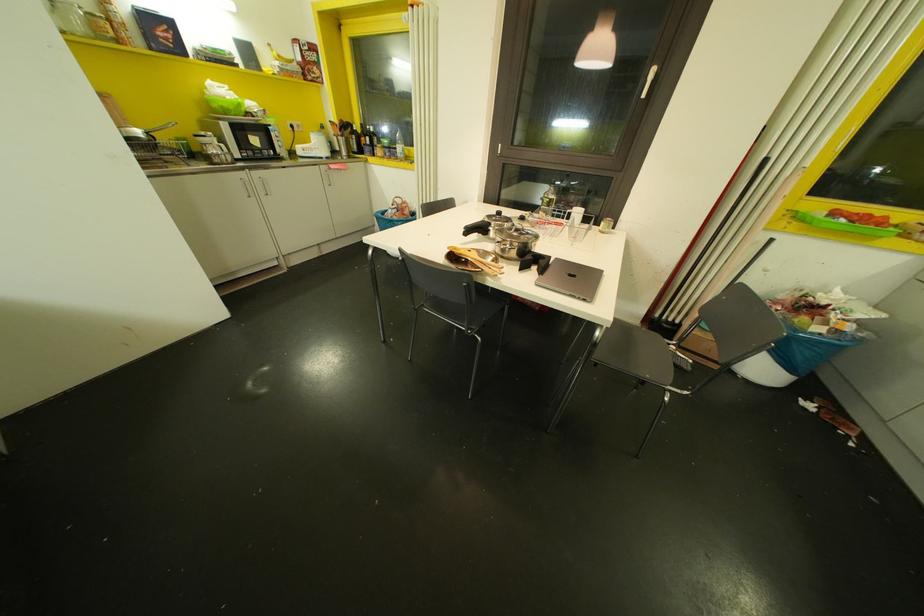
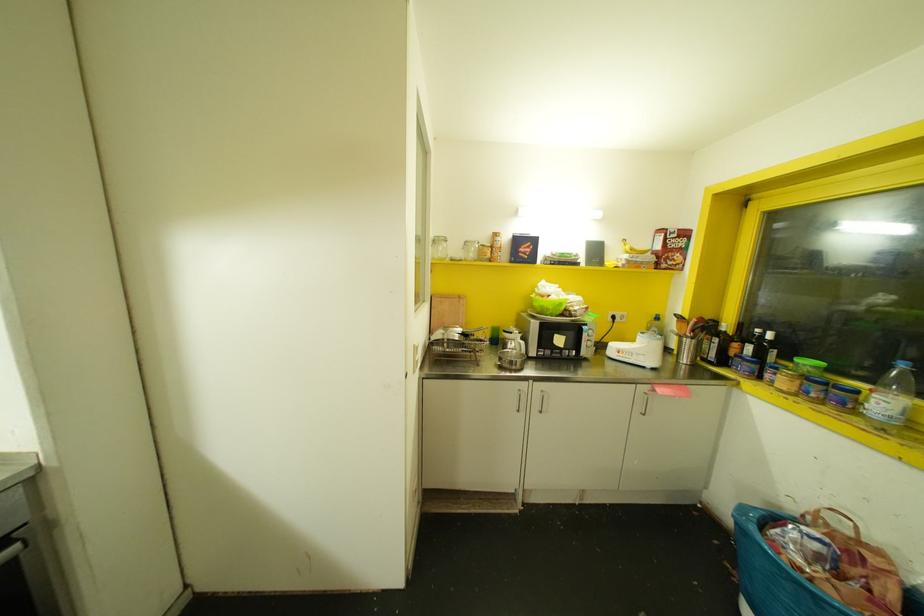
In the second image, find the point that corresponds to [238,103] in the first image.

(560, 304)